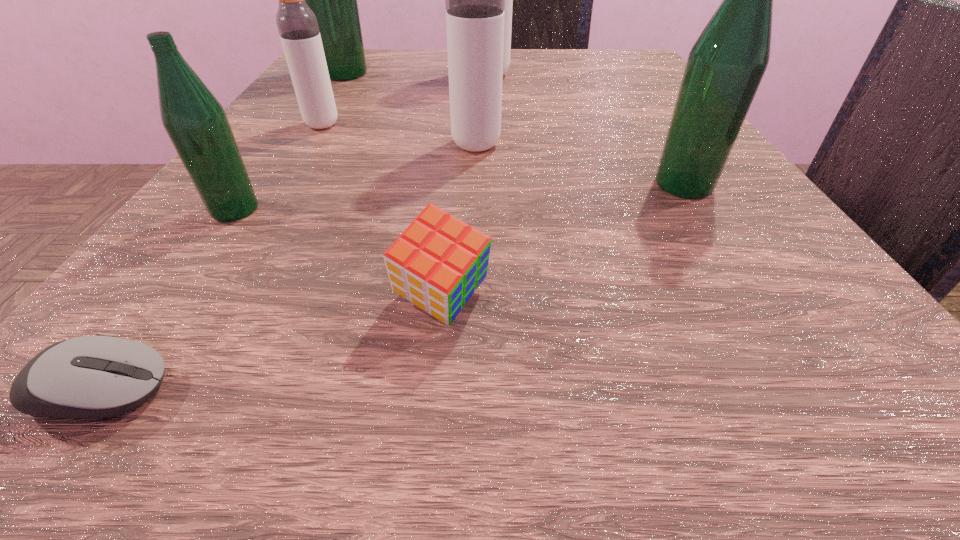
Choose which gray bottle is the nearest neighbor to the biggest green bottle. Please provide its 2D coordinates. Your answer should be formatted as a tuple, i.e. [(x, y)], where the tuple contains the x and y coordinates of a point satisfying the conditions above.

[(298, 28)]

This screenshot has height=540, width=960. In order to click on free space that satisfies the following two spatial constraints: 1. on the back side of the red cube; 2. on the right side of the third nearest bottle in this screenshot , I will do `click(456, 145)`.